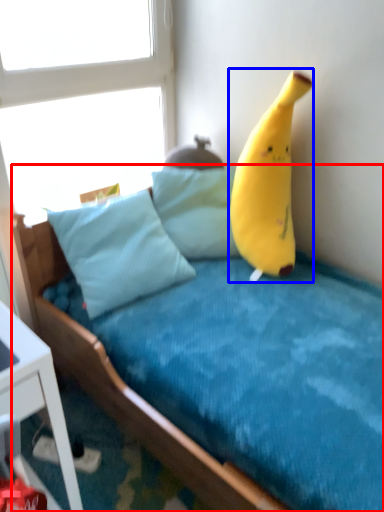
Question: Which point is further to the camera, bed (highlighted by a red box) or banana (highlighted by a blue box)?

Choices:
 (A) bed
 (B) banana

Answer: (B)